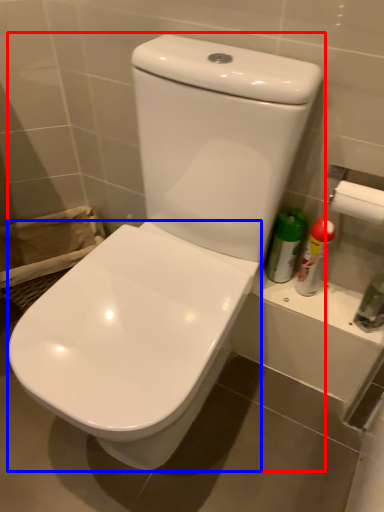
Question: Which of the following is the closest to the observer, toilet (highlighted by a red box) or toilet (highlighted by a blue box)?

Choices:
 (A) toilet
 (B) toilet

Answer: (A)